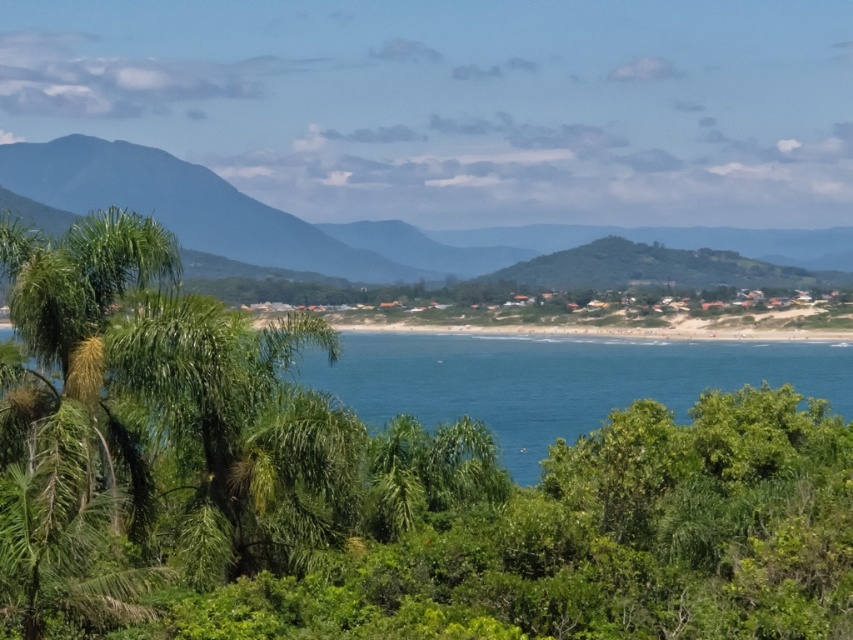
In the scene shown: Is blue water at center wider than green leafy mountain at center?

Incorrect, blue water at center's width does not surpass green leafy mountain at center's.

Who is more forward, (596, 378) or (409, 276)?

Point (596, 378) is more forward.

The width and height of the screenshot is (853, 640). I want to click on blue water at center, so click(x=556, y=380).